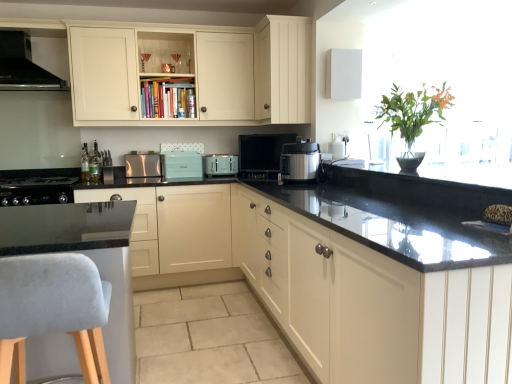
Image resolution: width=512 pixels, height=384 pixels. Identify the location of blank space above satin silver toaster at center, which is counted as the second kitchen appliance, starting from the top (from a real-world perspective). [x=141, y=153].